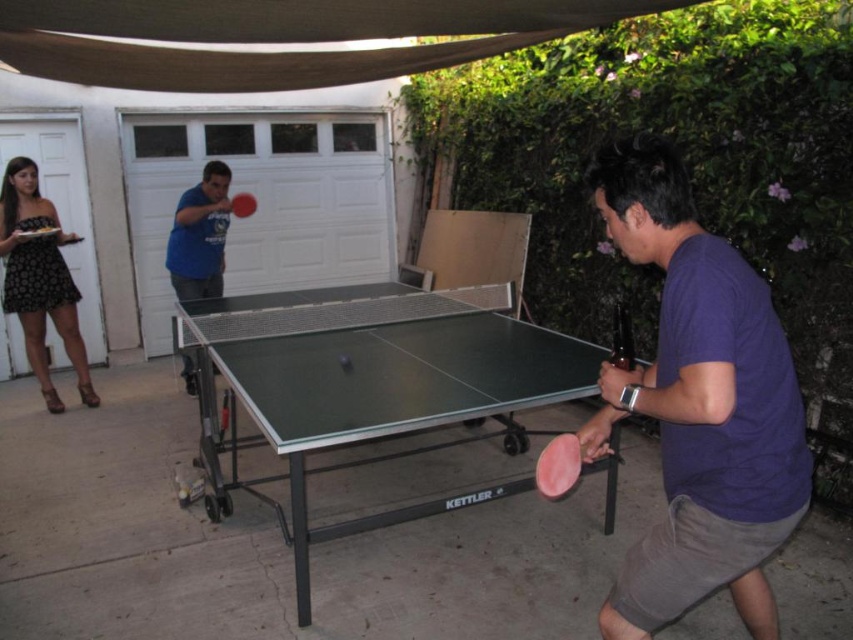
Between point (669, 460) and point (303, 515), which one is positioned behind?

The point (303, 515) is more distant.

Consider the image. Does purple matte shirt at right have a greater height compared to green rubber table tennis table at center?

No, purple matte shirt at right is not taller than green rubber table tennis table at center.

Measure the distance between point (782, 435) and camera.

Point (782, 435) is 5.04 feet from camera.

What are the coordinates of `purple matte shirt at right` in the screenshot? It's located at (699, 406).

Who is shorter, white matte garage door at center or pink rubber paddle at lower right?

With less height is pink rubber paddle at lower right.

Which is behind, point (360, 236) or point (576, 438)?

The point (360, 236) is behind.

The height and width of the screenshot is (640, 853). I want to click on white matte garage door at center, so click(262, 202).

Which is more to the right, purple matte shirt at right or black lace dress at left?

purple matte shirt at right

Does purple matte shirt at right have a smaller size compared to black lace dress at left?

Correct, purple matte shirt at right occupies less space than black lace dress at left.

Where is `purple matte shirt at right`? purple matte shirt at right is located at coordinates (699, 406).

This screenshot has height=640, width=853. What are the coordinates of `purple matte shirt at right` in the screenshot? It's located at (699, 406).